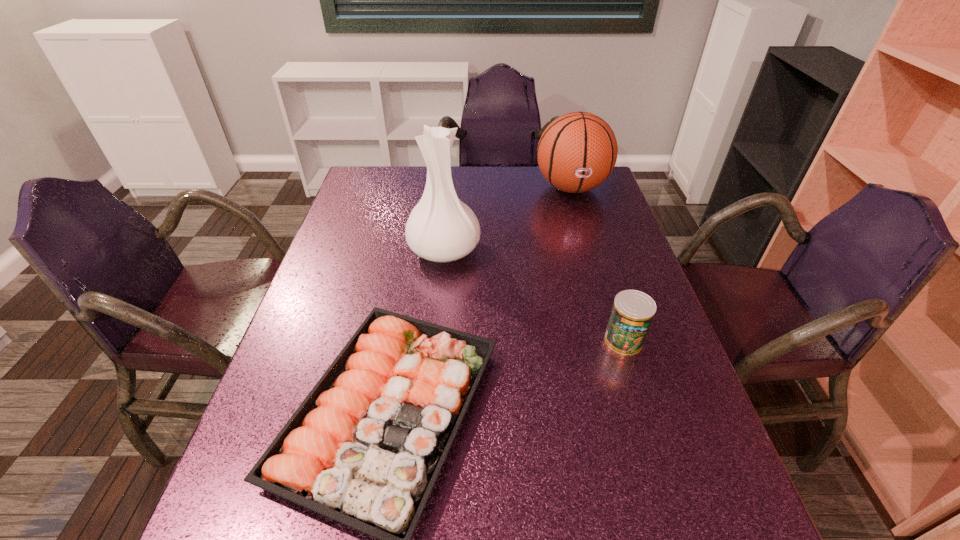
This screenshot has width=960, height=540. I want to click on vase, so tap(441, 228).

The width and height of the screenshot is (960, 540). What are the coordinates of `the third nearest object` in the screenshot? It's located at (441, 228).

You are a GUI agent. You are given a task and a screenshot of the screen. Output one action in this format:
    pyautogui.click(x=<x>, y=<y>)
    Task: Click on the basketball
    The width and height of the screenshot is (960, 540).
    Given the screenshot: What is the action you would take?
    pyautogui.click(x=577, y=152)

This screenshot has width=960, height=540. I want to click on the third shortest object, so click(577, 152).

Where is `can`? The height and width of the screenshot is (540, 960). can is located at coordinates (633, 311).

Find the location of a particular element. The image size is (960, 540). vacant space located 0.350m on the front of the vase is located at coordinates (431, 387).

I want to click on vacant region located 0.220m on the side where the inflation valve is located, so click(590, 252).

The image size is (960, 540). I want to click on blank space located on the left of the third tallest object, so click(x=521, y=340).

Find the location of a particular element. The height and width of the screenshot is (540, 960). object situated at the far edge is located at coordinates (577, 152).

The height and width of the screenshot is (540, 960). In order to click on basketball present at the right edge in this screenshot , I will do (x=577, y=152).